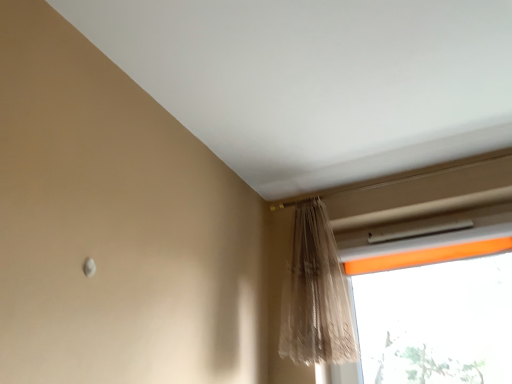
Locate an element on the screen. The width and height of the screenshot is (512, 384). orange fabric window at upper right is located at coordinates (433, 315).

In order to face orange fabric window at upper right, should I rotate leftwards or rightwards?

Rotate your view right by about 21.918°.

This screenshot has width=512, height=384. What do you see at coordinates (433, 315) in the screenshot? I see `orange fabric window at upper right` at bounding box center [433, 315].

What do you see at coordinates (316, 294) in the screenshot? This screenshot has height=384, width=512. I see `sheer beige curtain at upper right` at bounding box center [316, 294].

Image resolution: width=512 pixels, height=384 pixels. In order to click on sheer beige curtain at upper right in this screenshot , I will do `click(316, 294)`.

You are a GUI agent. You are given a task and a screenshot of the screen. Output one action in this format:
    pyautogui.click(x=<x>, y=<y>)
    Task: Click on the orange fabric window at upper right
    This screenshot has height=384, width=512.
    Given the screenshot: What is the action you would take?
    pyautogui.click(x=433, y=315)

Considering the positions of objects orange fabric window at upper right and sheer beige curtain at upper right in the image provided, who is more to the right, orange fabric window at upper right or sheer beige curtain at upper right?

orange fabric window at upper right is more to the right.

Which is behind, orange fabric window at upper right or sheer beige curtain at upper right?

→ orange fabric window at upper right is more distant.

Is point (407, 264) closer or farther from the camera than point (308, 215)?

Point (407, 264).

From the image's perspective, which is above, orange fabric window at upper right or sheer beige curtain at upper right?

sheer beige curtain at upper right appears higher in the image.

From a real-world perspective, is orange fabric window at upper right physically located above or below sheer beige curtain at upper right?

Clearly, from a real-world perspective, orange fabric window at upper right is below sheer beige curtain at upper right.

Considering the sizes of orange fabric window at upper right and sheer beige curtain at upper right in the image, is orange fabric window at upper right wider or thinner than sheer beige curtain at upper right?

In the image, orange fabric window at upper right appears to be more narrow than sheer beige curtain at upper right.

Can you confirm if orange fabric window at upper right is shorter than sheer beige curtain at upper right?

Yes.

Can you confirm if orange fabric window at upper right is bigger than sheer beige curtain at upper right?

Incorrect, orange fabric window at upper right is not larger than sheer beige curtain at upper right.

Does orange fabric window at upper right contain sheer beige curtain at upper right?

Actually, sheer beige curtain at upper right is outside orange fabric window at upper right.

Is orange fabric window at upper right far from sheer beige curtain at upper right?

They are positioned close to each other.

Is sheer beige curtain at upper right at the back of orange fabric window at upper right?

orange fabric window at upper right does not have its back to sheer beige curtain at upper right.

Can you tell me how much orange fabric window at upper right and sheer beige curtain at upper right differ in facing direction?

orange fabric window at upper right and sheer beige curtain at upper right are facing 1.72 degrees away from each other.

How much distance is there between orange fabric window at upper right and sheer beige curtain at upper right?

The distance of orange fabric window at upper right from sheer beige curtain at upper right is 17.21 inches.

The width and height of the screenshot is (512, 384). What are the coordinates of `curtain lying in front of the orange fabric window at upper right` in the screenshot? It's located at (316, 294).

Considering the positions of objects sheer beige curtain at upper right and orange fabric window at upper right in the image provided, who is more to the right, sheer beige curtain at upper right or orange fabric window at upper right?

Positioned to the right is orange fabric window at upper right.

In the image, is sheer beige curtain at upper right positioned in front of or behind orange fabric window at upper right?

sheer beige curtain at upper right is in front of orange fabric window at upper right.

Which is behind, point (331, 316) or point (350, 375)?

Point (350, 375)

From the image's perspective, is sheer beige curtain at upper right on top of orange fabric window at upper right?

Yes, from the image's perspective, sheer beige curtain at upper right is above orange fabric window at upper right.

From a real-world perspective, which object stands above the other?

sheer beige curtain at upper right.

Which of these two, sheer beige curtain at upper right or orange fabric window at upper right, is thinner?

Thinner between the two is orange fabric window at upper right.

Which of these two, sheer beige curtain at upper right or orange fabric window at upper right, stands taller?

With more height is sheer beige curtain at upper right.

Can you confirm if sheer beige curtain at upper right is bigger than orange fabric window at upper right?

Yes, sheer beige curtain at upper right is bigger than orange fabric window at upper right.

Is sheer beige curtain at upper right not within orange fabric window at upper right?

Indeed, sheer beige curtain at upper right is completely outside orange fabric window at upper right.

Does sheer beige curtain at upper right touch orange fabric window at upper right?

sheer beige curtain at upper right and orange fabric window at upper right are not in contact.

Does sheer beige curtain at upper right turn towards orange fabric window at upper right?

No, sheer beige curtain at upper right is not turned towards orange fabric window at upper right.

Based on the photo, measure the distance between sheer beige curtain at upper right and orange fabric window at upper right.

A distance of 17.21 inches exists between sheer beige curtain at upper right and orange fabric window at upper right.

The height and width of the screenshot is (384, 512). I want to click on curtain in front of the orange fabric window at upper right, so click(316, 294).

Locate an element on the screen. The width and height of the screenshot is (512, 384). curtain in front of the orange fabric window at upper right is located at coordinates (316, 294).

At what (x,y) coordinates should I click in order to perform the action: click on window lying below the sheer beige curtain at upper right (from the image's perspective). Please return your answer as a coordinate pair (x, y). This screenshot has height=384, width=512. Looking at the image, I should click on (433, 315).